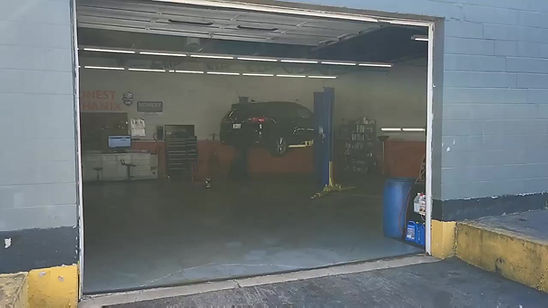
Locate an element on the screen. The height and width of the screenshot is (308, 548). monitor is located at coordinates (115, 142).